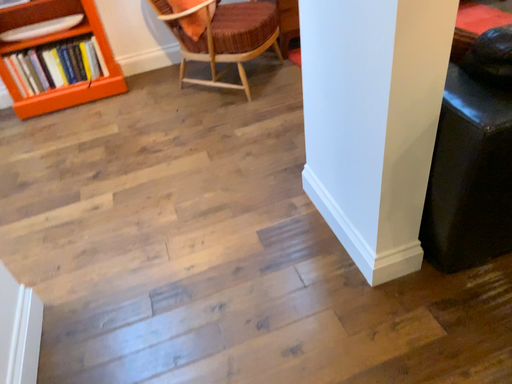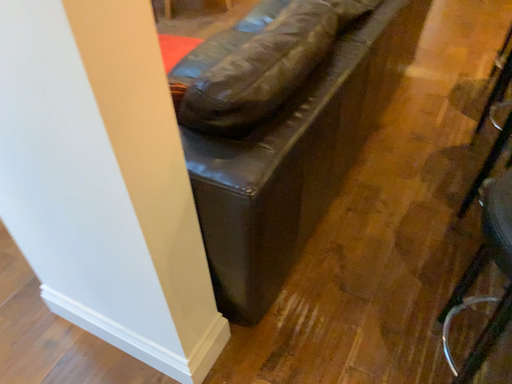
Question: How did the camera likely rotate when shooting the video?

Choices:
 (A) rotated upward
 (B) rotated downward

Answer: (A)